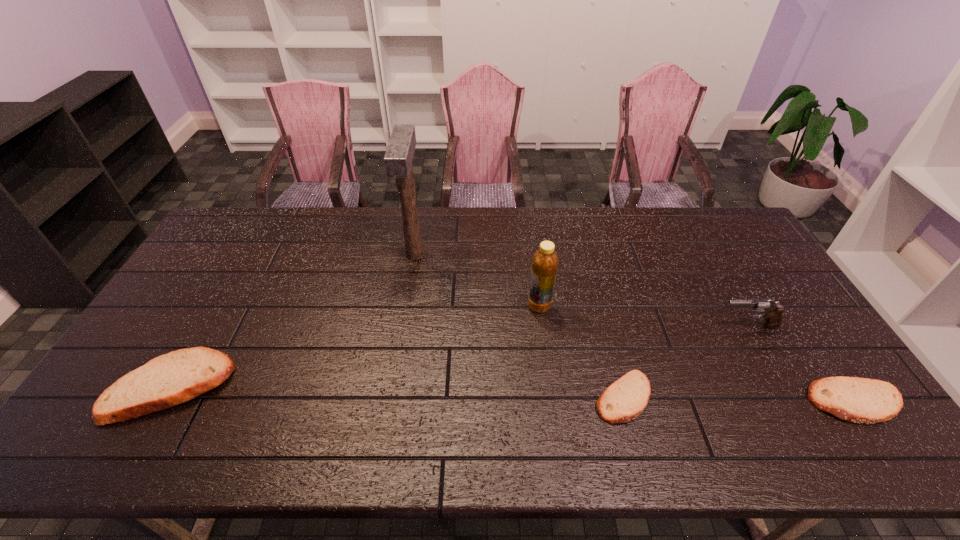
I want to click on free spot between the third farthest object and the third object from right to left, so click(x=685, y=361).

You are a GUI agent. You are given a task and a screenshot of the screen. Output one action in this format:
    pyautogui.click(x=<x>, y=<y>)
    Task: Click on the fourth closest object to the rightmost pita bread
    Image resolution: width=960 pixels, height=540 pixels.
    Given the screenshot: What is the action you would take?
    pyautogui.click(x=398, y=158)

Select which object appears as the third closest to the fourth tallest object. Please provide its 2D coordinates. Your answer should be formatted as a tuple, i.e. [(x, y)], where the tuple contains the x and y coordinates of a point satisfying the conditions above.

[(624, 400)]

Identify which pita bread is the closest to the third object from right to left. Please provide its 2D coordinates. Your answer should be formatted as a tuple, i.e. [(x, y)], where the tuple contains the x and y coordinates of a point satisfying the conditions above.

[(858, 400)]

Choose which pita bread is the second nearest neighbor to the fifth nearest object. Please provide its 2D coordinates. Your answer should be formatted as a tuple, i.e. [(x, y)], where the tuple contains the x and y coordinates of a point satisfying the conditions above.

[(858, 400)]

At what (x,y) coordinates should I click in order to perform the action: click on blank space that satisfies the following two spatial constraints: 1. on the front side of the second tallest pita bread; 2. on the left side of the bottle. Please return your answer as a coordinate pair (x, y). The width and height of the screenshot is (960, 540). Looking at the image, I should click on (552, 402).